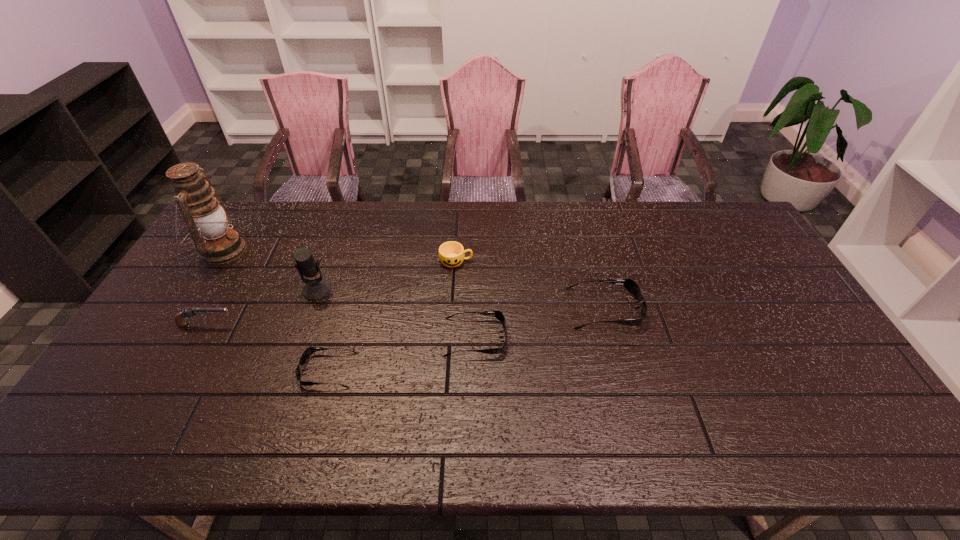
What are the coordinates of `vacant space located on the front-facing side of the shortest sunglasses` in the screenshot? It's located at point(186,370).

I want to click on free location located 0.250m on the front-facing side of the shortest sunglasses, so click(205, 370).

In order to click on vacant area located on the front-facing side of the shortest sunglasses in this screenshot , I will do `click(240, 370)`.

This screenshot has width=960, height=540. What are the coordinates of `vacant space located on the front-facing side of the second sunglasses from right to left` in the screenshot? It's located at (636, 338).

Locate an element on the screen. Image resolution: width=960 pixels, height=540 pixels. vacant area situated on the front-facing side of the rightmost object is located at coordinates (687, 308).

The width and height of the screenshot is (960, 540). Identify the location of vacant space positioned 0.340m on the back of the microphone. (344, 214).

Find the location of `vacant space located 0.270m aiming along the barrel of the gun`. vacant space located 0.270m aiming along the barrel of the gun is located at coordinates (329, 324).

Identify the location of free space located 0.210m on the front of the cup. This screenshot has width=960, height=540. (452, 320).

Identify the location of vacant point located on the front of the lantern. The height and width of the screenshot is (540, 960). (199, 288).

Locate an element on the screen. The width and height of the screenshot is (960, 540). object situated at the far edge is located at coordinates (208, 220).